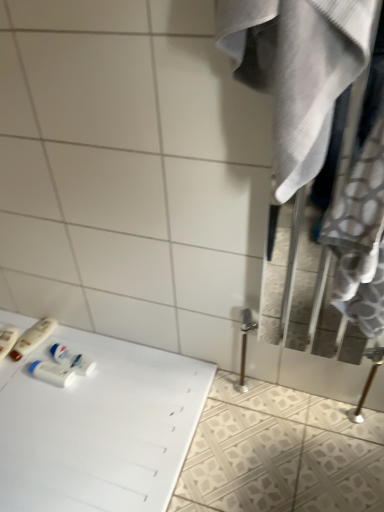
You are a GUI agent. You are given a task and a screenshot of the screen. Output one action in this format:
    pyautogui.click(x=<x>, y=<y>)
    Task: Click on the white plastic bottles at lower left, which ranks as the second toiletry in right-to-left order
    This screenshot has height=512, width=384.
    Given the screenshot: What is the action you would take?
    pyautogui.click(x=33, y=337)

This screenshot has height=512, width=384. What do you see at coordinates (7, 340) in the screenshot? I see `matte plastic toothbrush at lower left, the first toiletry in the left-to-right sequence` at bounding box center [7, 340].

Locate an element on the screen. This screenshot has width=384, height=512. white plastic bottles at lower left, which is the 2th toiletry from left to right is located at coordinates (33, 337).

From a real-world perspective, is white plastic tube at lower left, the 3th toiletry when ordered from left to right, physically below matte plastic toothbrush at lower left, acting as the 3th toiletry starting from the right?

No, from a real-world perspective, white plastic tube at lower left, the 3th toiletry when ordered from left to right, is not below matte plastic toothbrush at lower left, acting as the 3th toiletry starting from the right.

Does white plastic tube at lower left, which is the 1th toiletry from right to left, have a lesser width compared to matte plastic toothbrush at lower left, acting as the 3th toiletry starting from the right?

Indeed, white plastic tube at lower left, which is the 1th toiletry from right to left, has a lesser width compared to matte plastic toothbrush at lower left, acting as the 3th toiletry starting from the right.

From the image's perspective, does white plastic tube at lower left, which is the 1th toiletry from right to left, appear higher than matte plastic toothbrush at lower left, acting as the 3th toiletry starting from the right?

No.

What's the angular difference between white plastic tube at lower left, the 3th toiletry when ordered from left to right, and matte plastic toothbrush at lower left, acting as the 3th toiletry starting from the right,'s facing directions?

white plastic tube at lower left, the 3th toiletry when ordered from left to right, and matte plastic toothbrush at lower left, acting as the 3th toiletry starting from the right, are facing 10.8 degrees away from each other.

From their relative heights in the image, would you say white plastic tube at lower left, which is the 1th toiletry from right to left, is taller or shorter than white fabric closet at right?

white plastic tube at lower left, which is the 1th toiletry from right to left, is shorter than white fabric closet at right.

The height and width of the screenshot is (512, 384). I want to click on closet in front of the white plastic tube at lower left, the 3th toiletry when ordered from left to right, so click(x=297, y=73).

Considering the relative positions of white plastic tube at lower left, which is the 1th toiletry from right to left, and white fabric closet at right in the image provided, is white plastic tube at lower left, which is the 1th toiletry from right to left, in front of white fabric closet at right?

No, it is behind white fabric closet at right.

Is white fabric closet at right looking in the opposite direction of white glossy table at lower left?

white fabric closet at right does not have its back to white glossy table at lower left.

From the image's perspective, is white fabric closet at right positioned above or below white glossy table at lower left?

Based on their image positions, white fabric closet at right is located above white glossy table at lower left.

Would you say white fabric closet at right is outside white glossy table at lower left?

Absolutely, white fabric closet at right is external to white glossy table at lower left.

Could you tell me if white glossy table at lower left is turned towards matte plastic toothbrush at lower left, acting as the 3th toiletry starting from the right?

No, white glossy table at lower left is not oriented towards matte plastic toothbrush at lower left, acting as the 3th toiletry starting from the right.

Can you see white glossy table at lower left touching matte plastic toothbrush at lower left, the first toiletry in the left-to-right sequence?

No, white glossy table at lower left is not touching matte plastic toothbrush at lower left, the first toiletry in the left-to-right sequence.

Is white glossy table at lower left inside or outside of matte plastic toothbrush at lower left, acting as the 3th toiletry starting from the right?

white glossy table at lower left is not enclosed by matte plastic toothbrush at lower left, acting as the 3th toiletry starting from the right.

From a real-world perspective, is white glossy table at lower left physically located above or below matte plastic toothbrush at lower left, the first toiletry in the left-to-right sequence?

From a real-world perspective, white glossy table at lower left is physically below matte plastic toothbrush at lower left, the first toiletry in the left-to-right sequence.

From a real-world perspective, is white plastic mouthwash at lower left above or below matte plastic toothbrush at lower left, acting as the 3th toiletry starting from the right?

In terms of real-world spatial position, white plastic mouthwash at lower left is above matte plastic toothbrush at lower left, acting as the 3th toiletry starting from the right.

Which object is closer to the camera, white plastic mouthwash at lower left or matte plastic toothbrush at lower left, acting as the 3th toiletry starting from the right?

white plastic mouthwash at lower left.

Is matte plastic toothbrush at lower left, acting as the 3th toiletry starting from the right, at the back of white plastic mouthwash at lower left?

white plastic mouthwash at lower left does not have its back to matte plastic toothbrush at lower left, acting as the 3th toiletry starting from the right.

Between white plastic mouthwash at lower left and matte plastic toothbrush at lower left, the first toiletry in the left-to-right sequence, which one appears on the right side from the viewer's perspective?

white plastic mouthwash at lower left.

Relative to white fabric closet at right, is white plastic bottles at lower left, which is the 2th toiletry from left to right, in front or behind?

white plastic bottles at lower left, which is the 2th toiletry from left to right, is behind white fabric closet at right.

Considering the positions of objects white plastic bottles at lower left, which is the 2th toiletry from left to right, and white fabric closet at right in the image provided, who is more to the right, white plastic bottles at lower left, which is the 2th toiletry from left to right, or white fabric closet at right?

white fabric closet at right.

From a real-world perspective, does white plastic bottles at lower left, which ranks as the second toiletry in right-to-left order, stand above white fabric closet at right?

No.

Can you confirm if white plastic bottles at lower left, which ranks as the second toiletry in right-to-left order, is shorter than white fabric closet at right?

Yes.

In the image, is matte plastic toothbrush at lower left, acting as the 3th toiletry starting from the right, positioned in front of or behind white plastic tube at lower left, which is the 1th toiletry from right to left?

Visually, matte plastic toothbrush at lower left, acting as the 3th toiletry starting from the right, is located behind white plastic tube at lower left, which is the 1th toiletry from right to left.

In terms of width, does matte plastic toothbrush at lower left, acting as the 3th toiletry starting from the right, look wider or thinner when compared to white plastic tube at lower left, which is the 1th toiletry from right to left?

matte plastic toothbrush at lower left, acting as the 3th toiletry starting from the right, is wider than white plastic tube at lower left, which is the 1th toiletry from right to left.

Based on their sizes in the image, would you say matte plastic toothbrush at lower left, the first toiletry in the left-to-right sequence, is bigger or smaller than white plastic tube at lower left, which is the 1th toiletry from right to left?

Clearly, matte plastic toothbrush at lower left, the first toiletry in the left-to-right sequence, is larger in size than white plastic tube at lower left, which is the 1th toiletry from right to left.

Identify the location of the 2nd toiletry to the left of the white plastic tube at lower left, the 3th toiletry when ordered from left to right, counting from the anchor's position. The width and height of the screenshot is (384, 512). (7, 340).

Find the location of a particular element. Image resolution: width=384 pixels, height=512 pixels. closet above the white plastic tube at lower left, which is the 1th toiletry from right to left (from the image's perspective) is located at coordinates (297, 73).

Considering their positions, is white plastic tube at lower left, the 3th toiletry when ordered from left to right, positioned closer to white glossy table at lower left than matte plastic toothbrush at lower left, the first toiletry in the left-to-right sequence?

Based on the image, white plastic tube at lower left, the 3th toiletry when ordered from left to right, appears to be nearer to white glossy table at lower left.

Looking at the image, which one is located closer to white plastic bottles at lower left, which ranks as the second toiletry in right-to-left order, matte plastic toothbrush at lower left, the first toiletry in the left-to-right sequence, or white plastic mouthwash at lower left?

matte plastic toothbrush at lower left, the first toiletry in the left-to-right sequence.

Based on their spatial positions, is white glossy table at lower left or white plastic mouthwash at lower left closer to white plastic bottles at lower left, which ranks as the second toiletry in right-to-left order?

white plastic mouthwash at lower left is closer to white plastic bottles at lower left, which ranks as the second toiletry in right-to-left order.

Considering their positions, is white glossy table at lower left positioned closer to white plastic mouthwash at lower left than white fabric closet at right?

white glossy table at lower left.

When comparing their distances from white fabric closet at right, does white plastic mouthwash at lower left or white plastic bottles at lower left, which is the 2th toiletry from left to right, seem further?

white plastic bottles at lower left, which is the 2th toiletry from left to right, is positioned further to the anchor white fabric closet at right.

Which object lies nearer to the anchor point white plastic tube at lower left, which is the 1th toiletry from right to left, white plastic bottles at lower left, which ranks as the second toiletry in right-to-left order, or white glossy table at lower left?

white plastic bottles at lower left, which ranks as the second toiletry in right-to-left order, is positioned closer to the anchor white plastic tube at lower left, which is the 1th toiletry from right to left.

Looking at this image, from the image, which object appears to be nearer to white plastic tube at lower left, the 3th toiletry when ordered from left to right, white plastic bottles at lower left, which ranks as the second toiletry in right-to-left order, or white fabric closet at right?

white plastic bottles at lower left, which ranks as the second toiletry in right-to-left order, is positioned closer to the anchor white plastic tube at lower left, the 3th toiletry when ordered from left to right.

Estimate the real-world distances between objects in this image. Which object is closer to white plastic mouthwash at lower left, white fabric closet at right or white plastic tube at lower left, which is the 1th toiletry from right to left?

The object closer to white plastic mouthwash at lower left is white plastic tube at lower left, which is the 1th toiletry from right to left.

Find the location of a particular element. mouthwash situated between white glossy table at lower left and white fabric closet at right from left to right is located at coordinates (72, 359).

At what (x,y) coordinates should I click in order to perform the action: click on table between white plastic bottles at lower left, which is the 2th toiletry from left to right, and white fabric closet at right. Please return your answer as a coordinate pair (x, y). This screenshot has width=384, height=512. Looking at the image, I should click on (98, 428).

Where is `toiletry between white plastic bottles at lower left, which ranks as the second toiletry in right-to-left order, and white plastic mouthwash at lower left from left to right`? The width and height of the screenshot is (384, 512). toiletry between white plastic bottles at lower left, which ranks as the second toiletry in right-to-left order, and white plastic mouthwash at lower left from left to right is located at coordinates (51, 373).

This screenshot has width=384, height=512. Find the location of `toiletry between white plastic bottles at lower left, which ranks as the second toiletry in right-to-left order, and white fabric closet at right, in the horizontal direction`. toiletry between white plastic bottles at lower left, which ranks as the second toiletry in right-to-left order, and white fabric closet at right, in the horizontal direction is located at coordinates (51, 373).